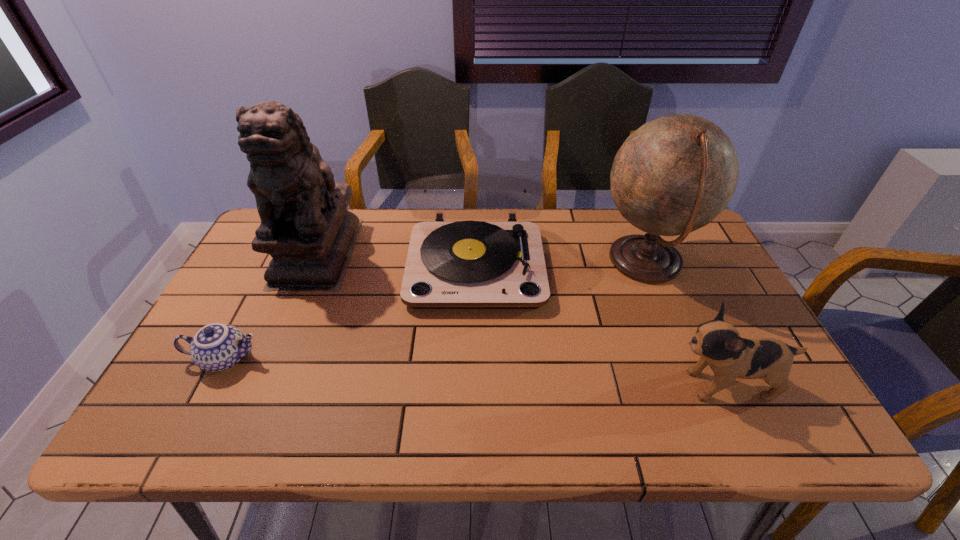
Find the location of a particular element. The height and width of the screenshot is (540, 960). free space located 0.090m with the tonearm facing the front of the record player is located at coordinates (475, 341).

Identify the location of vacant space located at the face of the second shortest object. The width and height of the screenshot is (960, 540). 499,385.

What are the coordinates of `free space located 0.220m at the face of the second shortest object` in the screenshot? It's located at (573, 385).

The height and width of the screenshot is (540, 960). Find the location of `free location located 0.140m at the face of the second shortest object`. free location located 0.140m at the face of the second shortest object is located at coordinates (609, 385).

Locate an element on the screen. The image size is (960, 540). blank area located 0.400m from the spout of the chinaware is located at coordinates (431, 359).

At what (x,y) coordinates should I click in order to perform the action: click on sculpture present at the far edge. Please return your answer as a coordinate pair (x, y). Looking at the image, I should click on (305, 227).

Where is `globe that is at the far edge`? This screenshot has width=960, height=540. globe that is at the far edge is located at coordinates (675, 174).

Image resolution: width=960 pixels, height=540 pixels. I want to click on record player located at the far edge, so click(469, 264).

This screenshot has width=960, height=540. Find the location of `object at the near edge`. object at the near edge is located at coordinates (718, 343).

Identify the location of sculpture that is at the left edge. This screenshot has height=540, width=960. (305, 227).